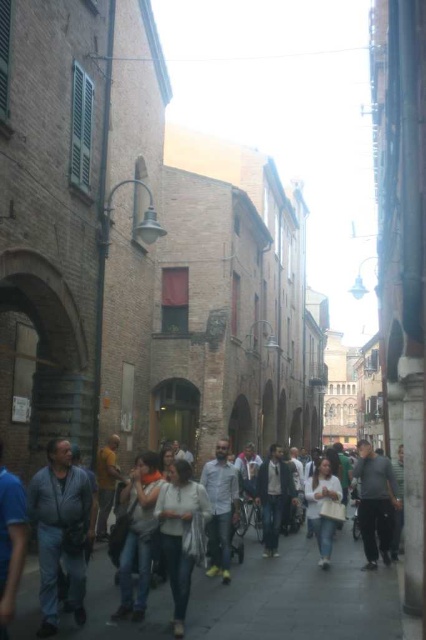
Question: Which point is closer to the camera?

Choices:
 (A) (198, 488)
 (B) (135, 600)

Answer: (B)

Question: Can you confirm if dark gray pants at center is positioned above denim jeans at center?

Choices:
 (A) no
 (B) yes

Answer: (B)

Question: Which object is the closest to the white matte sweater at center?

Choices:
 (A) denim jeans at center
 (B) matte gray scarf at center
 (C) dark gray pants at center

Answer: (B)

Question: Is the position of matte gray scarf at center more distant than that of white matte sweater at center?

Choices:
 (A) yes
 (B) no

Answer: (A)

Question: Which point is closer to the camera?

Choices:
 (A) (327, 545)
 (B) (196, 508)
 (C) (212, 605)

Answer: (C)

Question: Considering the relative positions of matte gray scarf at center and dark gray pants at center in the image provided, where is matte gray scarf at center located with respect to dark gray pants at center?

Choices:
 (A) above
 (B) below

Answer: (A)